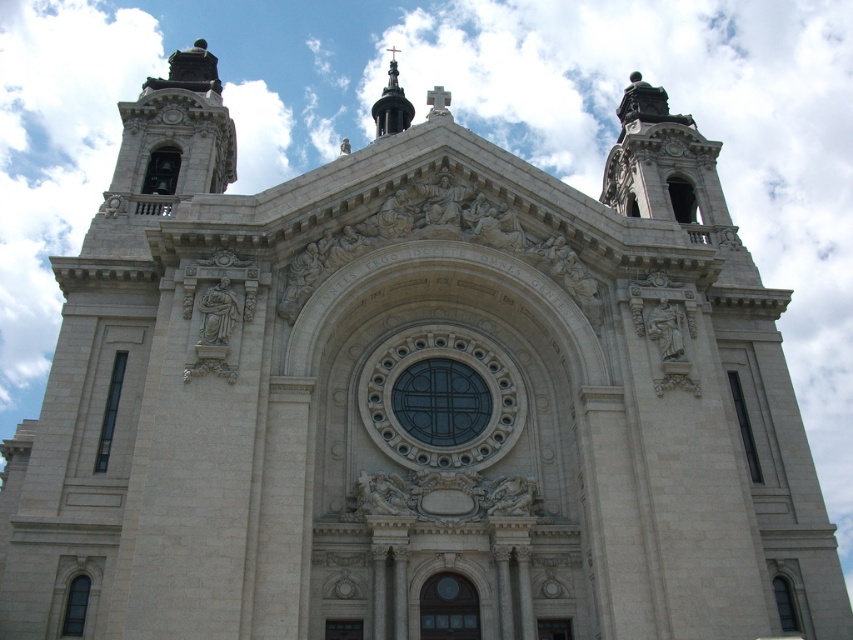
You are an architect analyzing the cathedral facade. You notice the shiny black spire at upper center and the white stone clock at upper center. Which of these two objects is bigger in size?

The shiny black spire at upper center is larger in size compared to the white stone clock at upper center.

In the scene shown: You are standing in front of the cathedral and want to take a photo of its central features. Which object, the shiny black spire at upper center or the white stone clock at upper center, should you focus on to capture the tallest element in your shot?

The shiny black spire at upper center is taller than the white stone clock at upper center, so focusing on it will capture the tallest element in the shot.

You are standing in front of the cathedral and want to take a photo of the shiny black spire at upper center. The camera you have can focus on objects up to 300 feet away. Will the spire be in focus?

The shiny black spire at upper center is 310.77 feet away from the viewer, which is beyond the camera focus limit of 300 feet. Therefore, the spire will not be in focus.